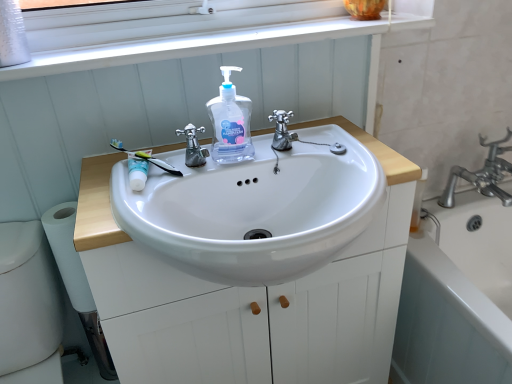
You are a GUI agent. You are given a task and a screenshot of the screen. Output one action in this format:
    pyautogui.click(x=<x>, y=<y>)
    Task: Click on the free space in front of white glossy mouthwash at upper left
    
    Given the screenshot: What is the action you would take?
    pyautogui.click(x=118, y=205)